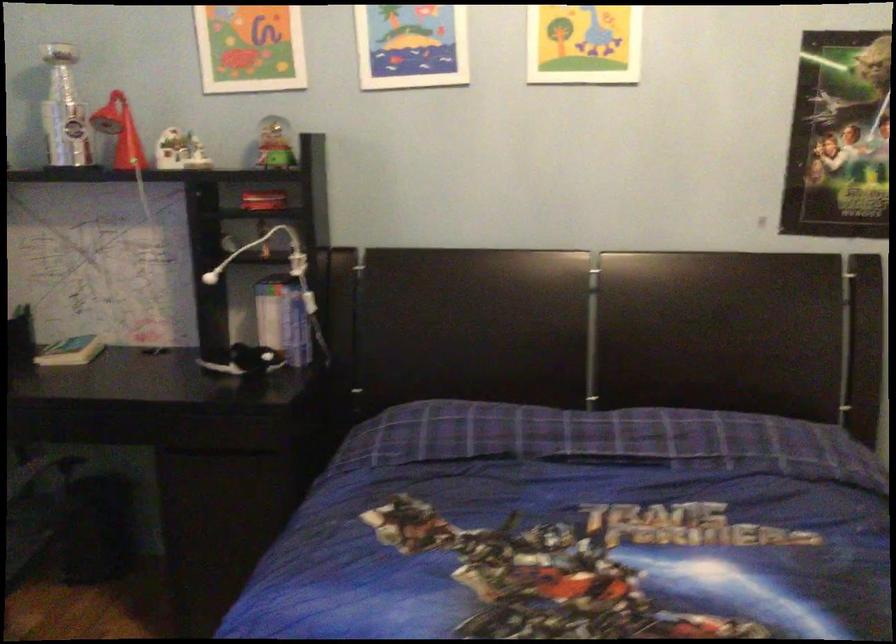
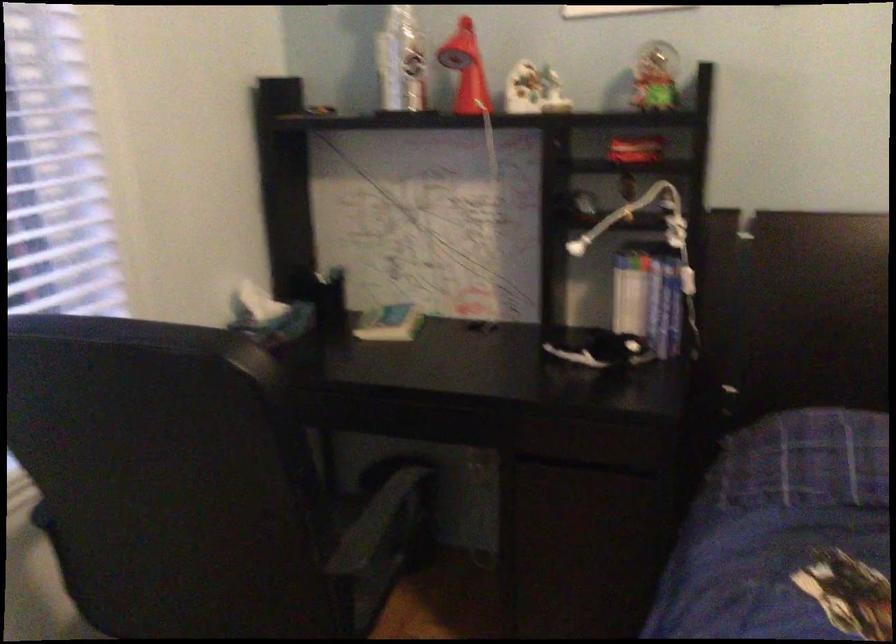
Locate, in the second image, the point that corresponds to pixel 118 131 in the first image.

(466, 69)